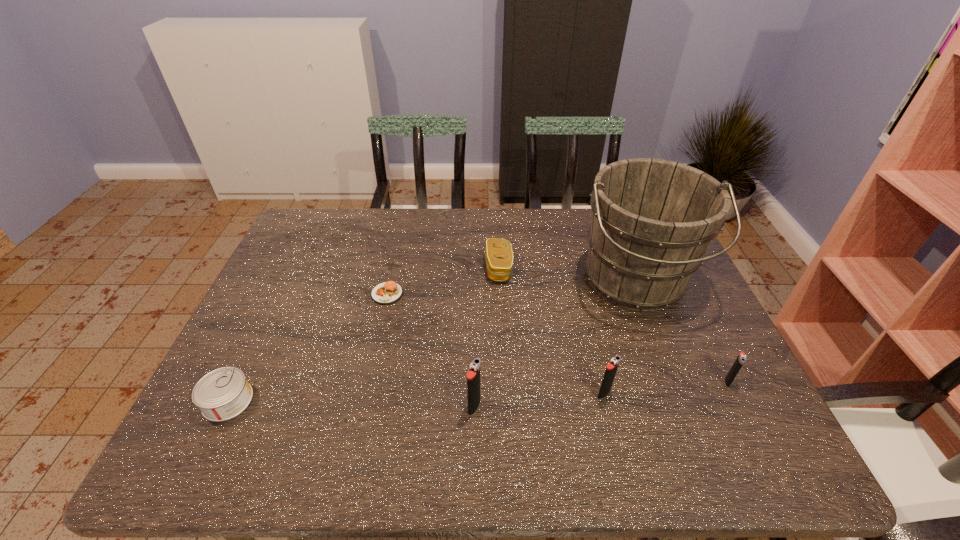
Where is `empty space that is in between the second igniter from right to left and the fourth tallest object`? empty space that is in between the second igniter from right to left and the fourth tallest object is located at coordinates (665, 388).

You are a GUI agent. You are given a task and a screenshot of the screen. Output one action in this format:
    pyautogui.click(x=<x>, y=<y>)
    Task: Click on the free spot between the tallest object and the leftmost object
    
    Given the screenshot: What is the action you would take?
    pyautogui.click(x=431, y=341)

Identify the location of free area in between the can and the tallest object. (431, 341).

Image resolution: width=960 pixels, height=540 pixels. I want to click on object that is the fourth closest one to the shortest object, so click(652, 221).

Locate an element on the screen. The width and height of the screenshot is (960, 540). the fourth closest object to the third tallest object is located at coordinates (498, 253).

Point out which igniter is positioned as the second nearest to the bucket. Please provide its 2D coordinates. Your answer should be formatted as a tuple, i.e. [(x, y)], where the tuple contains the x and y coordinates of a point satisfying the conditions above.

[(611, 369)]

You are a GUI agent. You are given a task and a screenshot of the screen. Output one action in this format:
    pyautogui.click(x=<x>, y=<y>)
    Task: Click on the second closest igniter to the patty
    The width and height of the screenshot is (960, 540).
    Given the screenshot: What is the action you would take?
    pyautogui.click(x=611, y=369)

Locate an element on the screen. Image resolution: width=960 pixels, height=540 pixels. vacant space that satisfies the following two spatial constraints: 1. on the zipper side of the second tallest igniter; 2. on the right side of the fourth object from right to left is located at coordinates (504, 394).

Where is `free region that satisfies the following two spatial constraints: 1. on the zipper side of the shortest igniter; 2. on the right side of the third shortest object`? The width and height of the screenshot is (960, 540). free region that satisfies the following two spatial constraints: 1. on the zipper side of the shortest igniter; 2. on the right side of the third shortest object is located at coordinates (504, 382).

Locate an element on the screen. The height and width of the screenshot is (540, 960). free spot that satisfies the following two spatial constraints: 1. on the front side of the third tallest object; 2. on the right side of the patty is located at coordinates (365, 394).